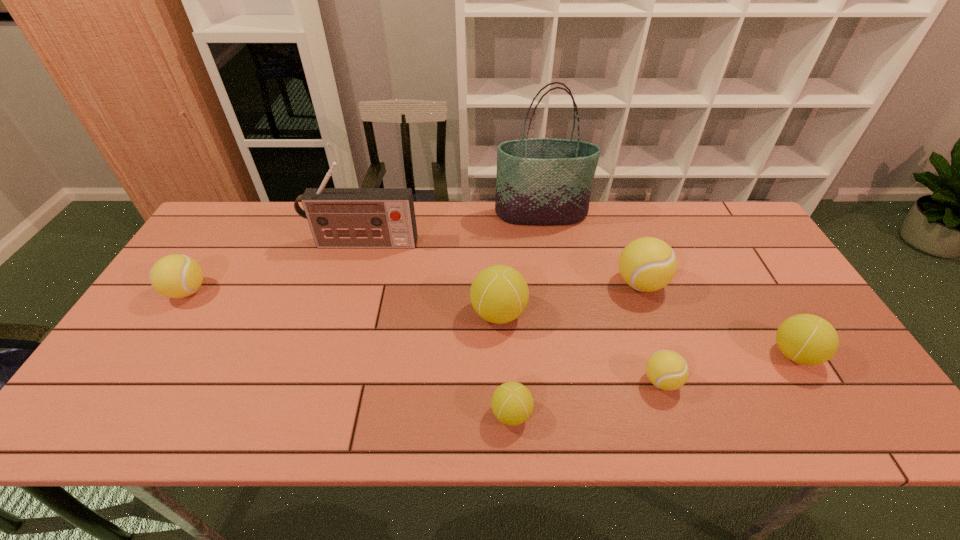
This screenshot has width=960, height=540. In order to click on vacant point located between the biggest green tennis ball and the nearest green tennis ball in this screenshot , I will do `click(505, 363)`.

Identify the location of empty space that is in between the biggest green tennis ball and the biggest yellow tennis ball. (569, 299).

Locate an element on the screen. The width and height of the screenshot is (960, 540). free spot between the biggest yellow tennis ball and the radio receiver is located at coordinates (501, 264).

This screenshot has width=960, height=540. Identify the location of blank region between the nearest green tennis ball and the radio receiver. (437, 329).

Find the location of a particular element. This screenshot has width=960, height=540. empty space between the tallest object and the second tallest object is located at coordinates (452, 229).

The width and height of the screenshot is (960, 540). I want to click on free point between the leftmost object and the rightmost tennis ball, so click(x=491, y=323).

I want to click on empty space between the leftmost tennis ball and the smallest green tennis ball, so click(349, 353).

In order to click on free space between the rightmost green tennis ball and the biggest yellow tennis ball in this screenshot , I will do `click(717, 319)`.

The height and width of the screenshot is (540, 960). Find the location of `object that is the fourth nearest to the biggest yellow tennis ball`. object that is the fourth nearest to the biggest yellow tennis ball is located at coordinates (499, 294).

Choose which object is the second nearest neighbor to the seventh object from right to left. Please provide its 2D coordinates. Your answer should be formatted as a tuple, i.e. [(x, y)], where the tuple contains the x and y coordinates of a point satisfying the conditions above.

[(175, 276)]